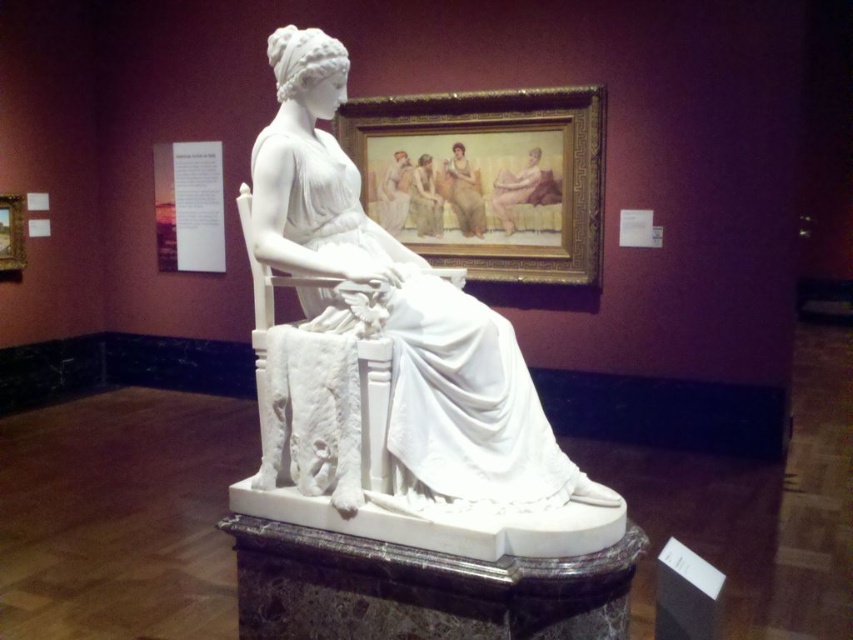
Question: Considering the real-world distances, which object is farthest from the matte white figure at center?

Choices:
 (A) smooth beige skin at upper center
 (B) white marble dress at center
 (C) smooth beige fabric at upper center

Answer: (B)

Question: Is white marble dress at center thinner than smooth beige skin at upper center?

Choices:
 (A) no
 (B) yes

Answer: (A)

Question: Which object appears closest to the camera in this image?

Choices:
 (A) smooth beige fabric at upper center
 (B) white marble dress at center
 (C) matte white figure at center

Answer: (B)

Question: Is the position of smooth beige fabric at upper center more distant than that of matte white figure at center?

Choices:
 (A) yes
 (B) no

Answer: (B)

Question: Does smooth beige fabric at upper center appear under smooth beige skin at upper center?

Choices:
 (A) no
 (B) yes

Answer: (B)

Question: Which of the following is the closest to the observer?

Choices:
 (A) (519, 177)
 (B) (437, 225)

Answer: (A)